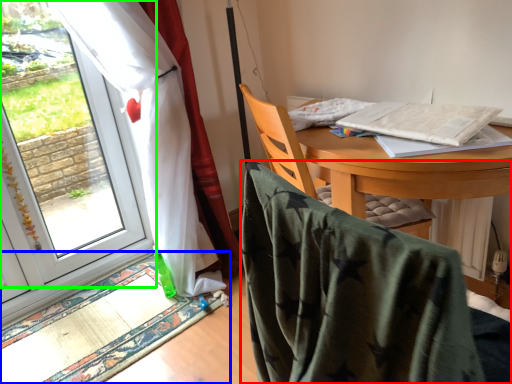
Question: Which object is positioned closest to chair (highlighted by a red box)? Select from mat (highlighted by a blue box) and window (highlighted by a green box).

Choices:
 (A) mat
 (B) window

Answer: (A)